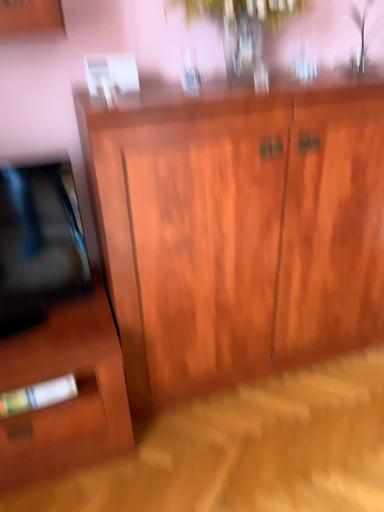
The image size is (384, 512). What are the coordinates of `matte wood side cabinet at lower left` in the screenshot? It's located at (69, 399).

Image resolution: width=384 pixels, height=512 pixels. Describe the element at coordinates (69, 399) in the screenshot. I see `matte wood side cabinet at lower left` at that location.

Locate an element on the screen. The height and width of the screenshot is (512, 384). wooden cabinet at center is located at coordinates (237, 229).

Describe the element at coordinates (237, 229) in the screenshot. The image size is (384, 512). I see `wooden cabinet at center` at that location.

Identify the location of matte wood side cabinet at lower left. (69, 399).

Between wooden cabinet at center and matte wood side cabinet at lower left, which one appears on the right side from the viewer's perspective?

wooden cabinet at center.

Considering the positions of objects wooden cabinet at center and matte wood side cabinet at lower left in the image provided, who is in front, wooden cabinet at center or matte wood side cabinet at lower left?

wooden cabinet at center is in front.

Between point (359, 233) and point (23, 356), which one is positioned behind?

The point (359, 233) is farther.

From the image's perspective, is wooden cabinet at center over matte wood side cabinet at lower left?

Yes, from the image's perspective, wooden cabinet at center is on top of matte wood side cabinet at lower left.

From a real-world perspective, which is physically below, wooden cabinet at center or matte wood side cabinet at lower left?

From a 3D spatial view, matte wood side cabinet at lower left is below.

Considering the sizes of wooden cabinet at center and matte wood side cabinet at lower left in the image, is wooden cabinet at center wider or thinner than matte wood side cabinet at lower left?

In the image, wooden cabinet at center appears to be more narrow than matte wood side cabinet at lower left.

Does wooden cabinet at center have a greater height compared to matte wood side cabinet at lower left?

Indeed, wooden cabinet at center has a greater height compared to matte wood side cabinet at lower left.

Is wooden cabinet at center smaller than matte wood side cabinet at lower left?

No.

Which is correct: wooden cabinet at center is inside matte wood side cabinet at lower left, or outside of it?

wooden cabinet at center exists outside the volume of matte wood side cabinet at lower left.

Is wooden cabinet at center far from matte wood side cabinet at lower left?

No.

Is wooden cabinet at center facing away from matte wood side cabinet at lower left?

wooden cabinet at center is not turned away from matte wood side cabinet at lower left.

How far apart are wooden cabinet at center and matte wood side cabinet at lower left?

wooden cabinet at center and matte wood side cabinet at lower left are 17.89 inches apart.

The image size is (384, 512). I want to click on side cabinet on the left of wooden cabinet at center, so click(69, 399).

Is matte wood side cabinet at lower left at the left side of wooden cabinet at center?

Indeed, matte wood side cabinet at lower left is positioned on the left side of wooden cabinet at center.

Based on the photo, considering the relative positions of matte wood side cabinet at lower left and wooden cabinet at center in the image provided, is matte wood side cabinet at lower left in front of wooden cabinet at center?

No, the depth of matte wood side cabinet at lower left is greater than that of wooden cabinet at center.

Considering the positions of point (69, 423) and point (174, 225), is point (69, 423) closer or farther from the camera than point (174, 225)?

Clearly, point (69, 423) is more distant from the camera than point (174, 225).

From the image's perspective, is matte wood side cabinet at lower left above or below wooden cabinet at center?

matte wood side cabinet at lower left is below wooden cabinet at center.

From a real-world perspective, which is physically below, matte wood side cabinet at lower left or wooden cabinet at center?

From a 3D spatial view, matte wood side cabinet at lower left is below.

Which of these two, matte wood side cabinet at lower left or wooden cabinet at center, is wider?

With larger width is matte wood side cabinet at lower left.

Considering the sizes of matte wood side cabinet at lower left and wooden cabinet at center in the image, is matte wood side cabinet at lower left taller or shorter than wooden cabinet at center?

Considering their sizes, matte wood side cabinet at lower left has less height than wooden cabinet at center.

Is matte wood side cabinet at lower left bigger or smaller than wooden cabinet at center?

In the image, matte wood side cabinet at lower left appears to be smaller than wooden cabinet at center.

Choose the correct answer: Is matte wood side cabinet at lower left inside wooden cabinet at center or outside it?

matte wood side cabinet at lower left is not enclosed by wooden cabinet at center.

Would you say matte wood side cabinet at lower left is a long distance from wooden cabinet at center?

No, matte wood side cabinet at lower left is not far from wooden cabinet at center.

Is wooden cabinet at center at the back of matte wood side cabinet at lower left?

No, matte wood side cabinet at lower left's orientation is not away from wooden cabinet at center.

Consider the image. What's the angular difference between matte wood side cabinet at lower left and wooden cabinet at center's facing directions?

There is a 0.138-degree angle between the facing directions of matte wood side cabinet at lower left and wooden cabinet at center.

Locate an element on the screen. side cabinet that appears below the wooden cabinet at center (from a real-world perspective) is located at coordinates (69, 399).

The image size is (384, 512). In the image, there is a wooden cabinet at center. Identify the location of side cabinet below it (from a real-world perspective). [69, 399].

Image resolution: width=384 pixels, height=512 pixels. I want to click on cupboard on the right of matte wood side cabinet at lower left, so click(x=237, y=229).